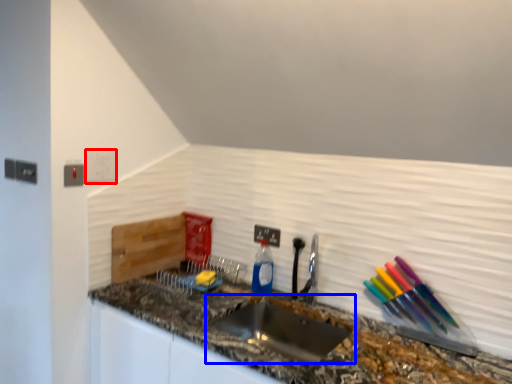
Question: Which object appears farthest to the camera in this image, light switch (highlighted by a red box) or sink (highlighted by a blue box)?

Choices:
 (A) light switch
 (B) sink

Answer: (A)